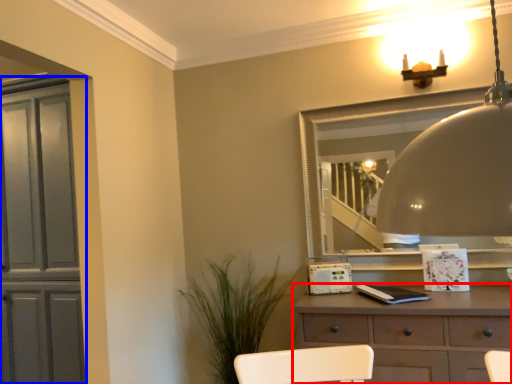
Question: Which object appears farthest to the camera in this image, chest of drawers (highlighted by a red box) or cabinetry (highlighted by a blue box)?

Choices:
 (A) chest of drawers
 (B) cabinetry

Answer: (B)